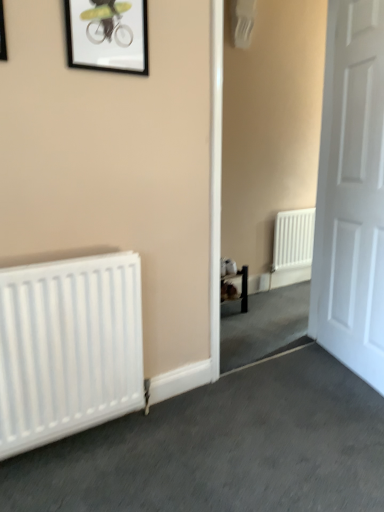
Question: Can you confirm if matte black picture frame at upper left, the 2th picture frame when ordered from back to front, is thinner than white matte door at right?

Choices:
 (A) yes
 (B) no

Answer: (A)

Question: From the image's perspective, would you say matte black picture frame at upper left, the 1th picture frame in the left-to-right sequence, is positioned over white matte door at right?

Choices:
 (A) yes
 (B) no

Answer: (A)

Question: Is matte black picture frame at upper left, marked as the second picture frame in a right-to-left arrangement, turned away from white matte door at right?

Choices:
 (A) yes
 (B) no

Answer: (B)

Question: Is matte black picture frame at upper left, marked as the second picture frame in a right-to-left arrangement, wider than white matte door at right?

Choices:
 (A) no
 (B) yes

Answer: (A)

Question: From a real-world perspective, is matte black picture frame at upper left, which ranks as the 1th picture frame in front-to-back order, positioned under white matte door at right based on gravity?

Choices:
 (A) no
 (B) yes

Answer: (A)

Question: From the image's perspective, is white matte door at right positioned above or below black matte picture frame at upper center, which is counted as the first picture frame, starting from the right?

Choices:
 (A) above
 (B) below

Answer: (B)

Question: Considering the positions of point (360, 40) and point (102, 46), is point (360, 40) closer or farther from the camera than point (102, 46)?

Choices:
 (A) farther
 (B) closer

Answer: (A)

Question: Is white matte door at right spatially inside black matte picture frame at upper center, which is counted as the first picture frame, starting from the right, or outside of it?

Choices:
 (A) outside
 (B) inside

Answer: (A)

Question: Considering their positions, is white matte door at right located in front of or behind black matte picture frame at upper center, which is counted as the first picture frame, starting from the right?

Choices:
 (A) behind
 (B) front

Answer: (A)

Question: Is white matte radiator at left taller or shorter than black matte picture frame at upper center, which ranks as the 2th picture frame in left-to-right order?

Choices:
 (A) short
 (B) tall

Answer: (B)

Question: Relative to black matte picture frame at upper center, which ranks as the 2th picture frame in left-to-right order, is white matte radiator at left in front or behind?

Choices:
 (A) front
 (B) behind

Answer: (A)

Question: From a real-world perspective, is white matte radiator at left physically located above or below black matte picture frame at upper center, placed as the 2th picture frame when sorted from front to back?

Choices:
 (A) below
 (B) above

Answer: (A)

Question: In terms of width, does white matte radiator at left look wider or thinner when compared to black matte picture frame at upper center, which ranks as the 2th picture frame in left-to-right order?

Choices:
 (A) thin
 (B) wide

Answer: (B)

Question: From the image's perspective, is white matte door at right above or below matte black picture frame at upper left, the 1th picture frame in the left-to-right sequence?

Choices:
 (A) below
 (B) above

Answer: (A)

Question: From a real-world perspective, relative to matte black picture frame at upper left, marked as the second picture frame in a right-to-left arrangement, is white matte door at right vertically above or below?

Choices:
 (A) below
 (B) above

Answer: (A)